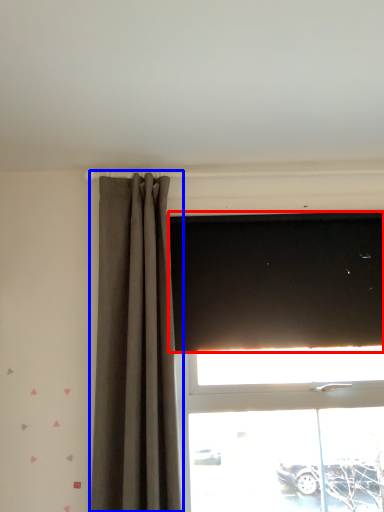
Question: Which point is further to the camera, blind (highlighted by a red box) or curtain (highlighted by a blue box)?

Choices:
 (A) blind
 (B) curtain

Answer: (A)